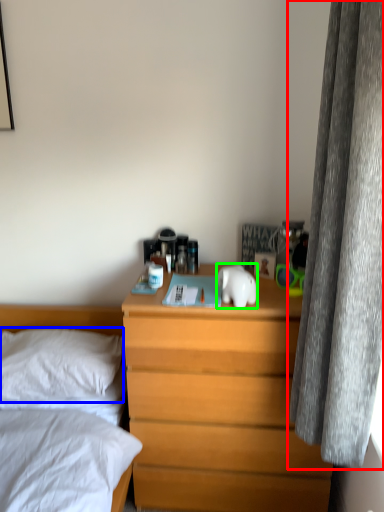
Question: Which is farther away from curtain (highlighted by a red box)? pillow (highlighted by a blue box) or animal (highlighted by a green box)?

Choices:
 (A) pillow
 (B) animal

Answer: (A)